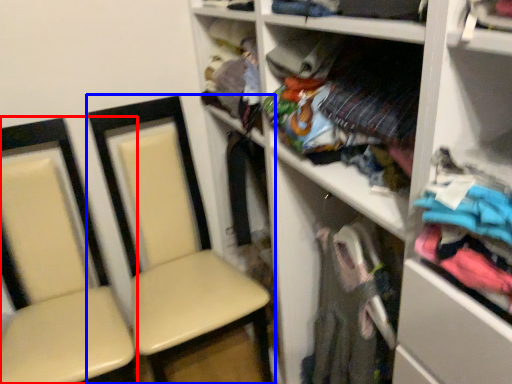
Question: Which object appears closest to the camera in this image, chair (highlighted by a red box) or chair (highlighted by a blue box)?

Choices:
 (A) chair
 (B) chair

Answer: (A)